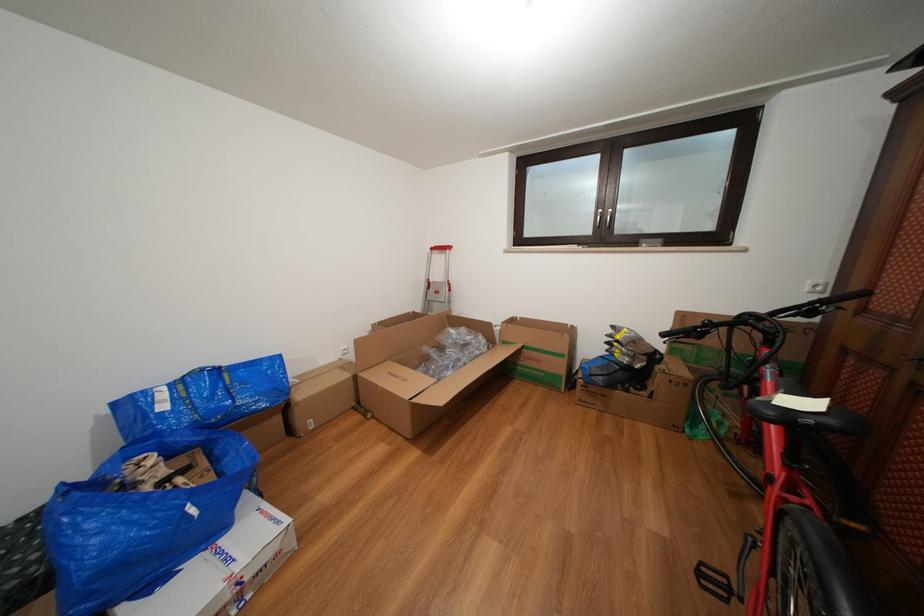
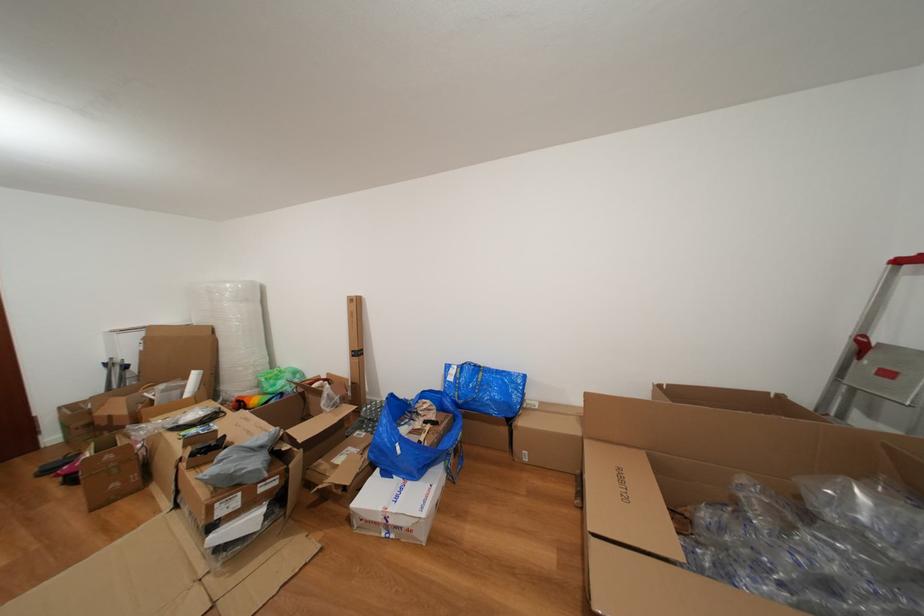
Question: I am providing you with two images of the same scene from different viewpoints. Please identify which objects are invisible in image2.

Choices:
 (A) large plastic roll
 (B) white Intersport box
 (C) tall cardboard box
 (D) none of these

Answer: (D)